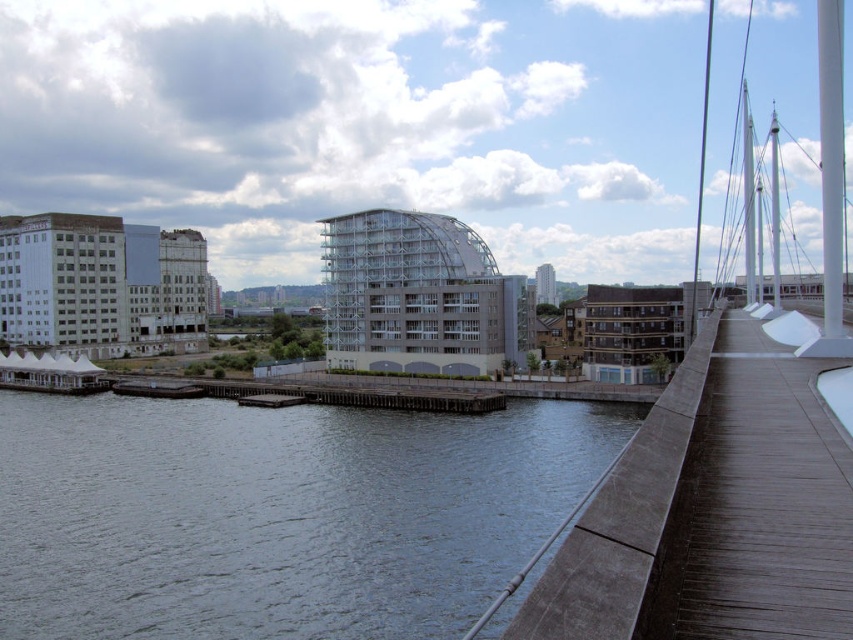
You are a delivery drone with a wingspan of 6 feet. You need to fly from the dark gray water at lower left to the brown wooden path at right. Is there enough space between them for you to pass through?

The distance between the dark gray water at lower left and the brown wooden path at right is 97.47 feet. Since your wingspan is only 6 feet, there is ample space for you to pass through safely.

You are standing on the brown wooden path at right and want to walk to the dark gray water at lower left. Is the path going uphill or downhill towards the water?

The dark gray water at lower left is much taller than the brown wooden path at right, so the path is going uphill towards the water.